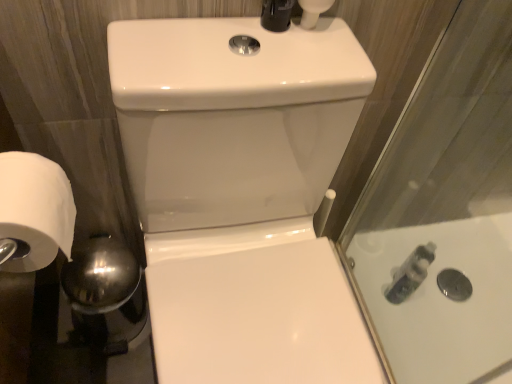
Question: Is translucent plastic bottle at right bigger than white matte toilet paper at left?

Choices:
 (A) yes
 (B) no

Answer: (B)

Question: Is translucent plastic bottle at right surrounding white matte toilet paper at left?

Choices:
 (A) yes
 (B) no

Answer: (B)

Question: Does translucent plastic bottle at right have a lesser width compared to white matte toilet paper at left?

Choices:
 (A) no
 (B) yes

Answer: (B)

Question: From a real-world perspective, is translucent plastic bottle at right physically above white matte toilet paper at left?

Choices:
 (A) yes
 (B) no

Answer: (B)

Question: Can you confirm if translucent plastic bottle at right is taller than white matte toilet paper at left?

Choices:
 (A) yes
 (B) no

Answer: (A)

Question: Is translucent plastic bottle at right located outside white matte toilet paper at left?

Choices:
 (A) no
 (B) yes

Answer: (B)

Question: Is white glossy sink at center smaller than white matte toilet paper at left?

Choices:
 (A) yes
 (B) no

Answer: (B)

Question: Is white glossy sink at center located outside white matte toilet paper at left?

Choices:
 (A) yes
 (B) no

Answer: (A)

Question: Does white glossy sink at center have a greater height compared to white matte toilet paper at left?

Choices:
 (A) yes
 (B) no

Answer: (A)

Question: Can you confirm if white glossy sink at center is wider than white matte toilet paper at left?

Choices:
 (A) yes
 (B) no

Answer: (A)

Question: Is white glossy sink at center to the right of white matte toilet paper at left from the viewer's perspective?

Choices:
 (A) no
 (B) yes

Answer: (B)

Question: From a real-world perspective, is white glossy sink at center physically below white matte toilet paper at left?

Choices:
 (A) no
 (B) yes

Answer: (B)

Question: From a real-world perspective, is white glossy sink at center below translucent plastic bottle at right?

Choices:
 (A) yes
 (B) no

Answer: (B)